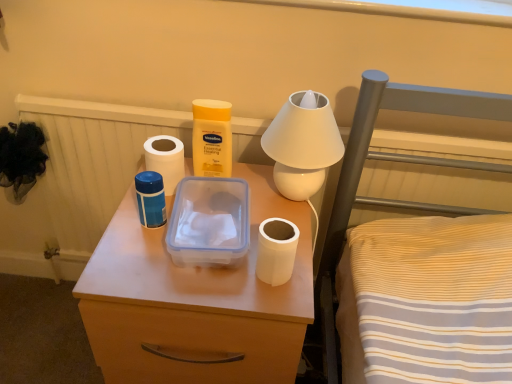
Question: Is white glossy table lamp at upper center oriented away from blue plastic thermos at center?

Choices:
 (A) no
 (B) yes

Answer: (A)

Question: From the image's perspective, would you say white glossy table lamp at upper center is positioned over blue plastic thermos at center?

Choices:
 (A) no
 (B) yes

Answer: (B)

Question: Is white glossy table lamp at upper center next to blue plastic thermos at center and touching it?

Choices:
 (A) yes
 (B) no

Answer: (B)

Question: From a real-world perspective, is white glossy table lamp at upper center positioned under blue plastic thermos at center based on gravity?

Choices:
 (A) no
 (B) yes

Answer: (A)

Question: Is white glossy table lamp at upper center to the left of blue plastic thermos at center from the viewer's perspective?

Choices:
 (A) yes
 (B) no

Answer: (B)

Question: Can you confirm if white glossy table lamp at upper center is shorter than blue plastic thermos at center?

Choices:
 (A) no
 (B) yes

Answer: (A)

Question: From the image's perspective, does white matte toilet paper at center, which is the 1th toilet paper in bottom-to-top order, appear lower than white glossy table lamp at upper center?

Choices:
 (A) no
 (B) yes

Answer: (B)

Question: Would you say white matte toilet paper at center, the second toilet paper viewed from the back, is outside white glossy table lamp at upper center?

Choices:
 (A) no
 (B) yes

Answer: (B)

Question: Considering the relative positions of white matte toilet paper at center, the second toilet paper viewed from the back, and white glossy table lamp at upper center in the image provided, is white matte toilet paper at center, the second toilet paper viewed from the back, in front of white glossy table lamp at upper center?

Choices:
 (A) no
 (B) yes

Answer: (B)

Question: Is the surface of white matte toilet paper at center, the second toilet paper viewed from the back, in direct contact with white glossy table lamp at upper center?

Choices:
 (A) no
 (B) yes

Answer: (A)

Question: From a real-world perspective, is white matte toilet paper at center, the second toilet paper viewed from the back, on white glossy table lamp at upper center?

Choices:
 (A) yes
 (B) no

Answer: (B)

Question: Does white matte toilet paper at center, which is the 1th toilet paper in bottom-to-top order, appear on the left side of white glossy table lamp at upper center?

Choices:
 (A) no
 (B) yes

Answer: (B)

Question: Is matte plastic container at center shorter than white matte toilet paper at center, placed as the second toilet paper when sorted from left to right?

Choices:
 (A) yes
 (B) no

Answer: (B)